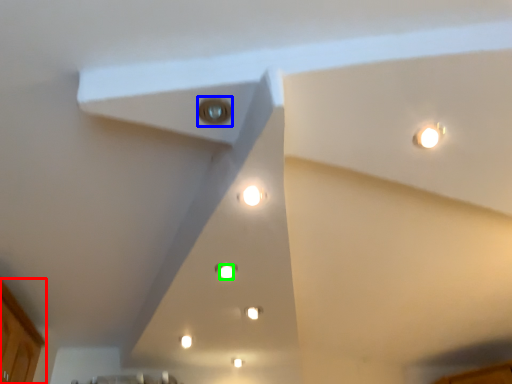
Question: Which object is the farthest from cabinetry (highlighted by a red box)? Choose among these: light (highlighted by a blue box) or light (highlighted by a green box).

Choices:
 (A) light
 (B) light

Answer: (A)